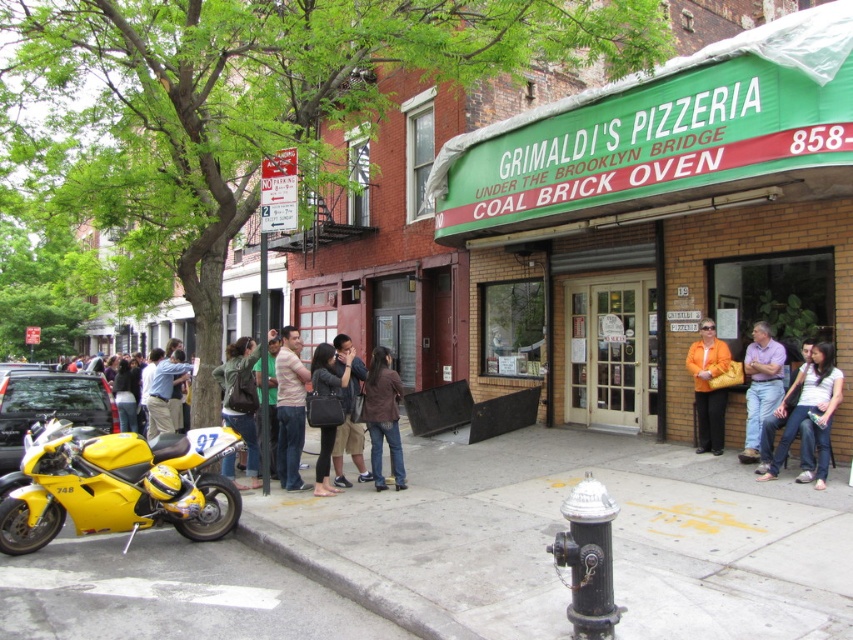
Which is more to the right, black leather jacket at center or light blue shirt at center?

black leather jacket at center

Find the location of a particular element. black leather jacket at center is located at coordinates (x=328, y=372).

Is point (164, 387) positioned before point (276, 419)?

No, (164, 387) is behind (276, 419).

Who is more forward, (148, 403) or (256, 387)?

Positioned in front is point (256, 387).

Is point (170, 428) closer to viewer compared to point (257, 381)?

No, (170, 428) is behind (257, 381).

The image size is (853, 640). In order to click on light blue shirt at center in this screenshot , I will do `click(164, 392)`.

Who is more forward, (x=352, y=401) or (x=271, y=360)?

Point (x=352, y=401)

Is point (354, 458) less distant than point (268, 362)?

Yes, point (354, 458) is closer to viewer.

Locate an element on the screen. The image size is (853, 640). matte black jacket at center is located at coordinates (347, 413).